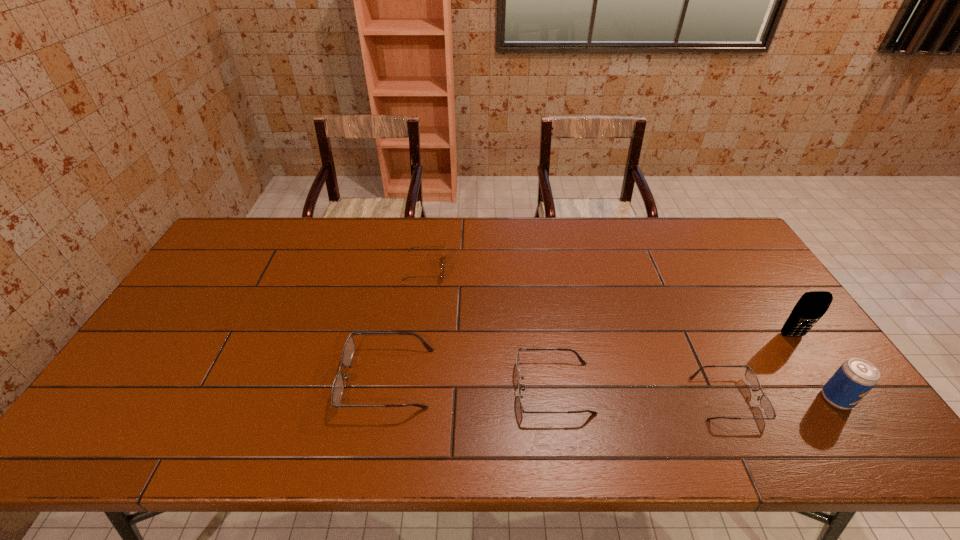
Locate an element on the screen. The image size is (960, 540). free space between the second farthest object and the fourth tallest object is located at coordinates (589, 357).

At what (x,y) coordinates should I click in order to perform the action: click on free space between the sunglasses and the fourth object from right to left. Please return your answer as a coordinate pair (x, y). This screenshot has height=540, width=960. Looking at the image, I should click on (490, 328).

This screenshot has width=960, height=540. I want to click on vacant region between the fourth object from right to left and the beer can, so click(695, 394).

The image size is (960, 540). What are the coordinates of `the fourth closest object to the second spectacles from left to right` in the screenshot? It's located at (811, 306).

This screenshot has width=960, height=540. Identify the location of object that is the nearest to the beer can. (811, 306).

Select which spectacles is the closest to the beer can. Please provide its 2D coordinates. Your answer should be formatted as a tuple, i.e. [(x, y)], where the tuple contains the x and y coordinates of a point satisfying the conditions above.

[(751, 377)]

Select which spectacles appears as the second closest to the rightmost spectacles. Please provide its 2D coordinates. Your answer should be formatted as a tuple, i.e. [(x, y)], where the tuple contains the x and y coordinates of a point satisfying the conditions above.

[(338, 385)]

Locate an element on the screen. The height and width of the screenshot is (540, 960). blank area in the image that satisfies the following two spatial constraints: 1. on the screen of the cellular telephone; 2. on the right side of the second tallest object is located at coordinates (835, 399).

You are a GUI agent. You are given a task and a screenshot of the screen. Output one action in this format:
    pyautogui.click(x=<x>, y=<y>)
    Task: Click on the free point that satisfies the following two spatial constraints: 1. on the front-facing side of the beer can; 2. on the right side of the second shortest spectacles
    This screenshot has height=540, width=960.
    Given the screenshot: What is the action you would take?
    pyautogui.click(x=556, y=399)

In order to click on blank area in the image that satisfies the following two spatial constraints: 1. on the front-facing side of the leftmost spectacles; 2. on the left side of the second tallest object in this screenshot , I will do 383,399.